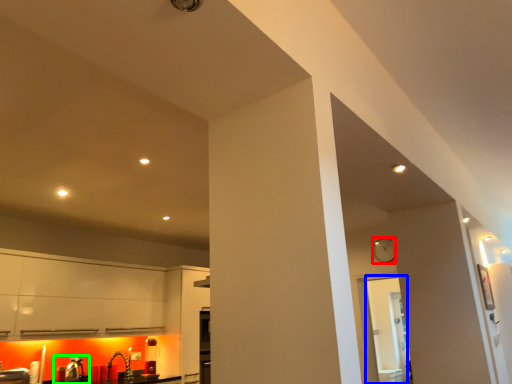
Question: Which object is the closest to the clock (highlighted by a red box)? Choose among these: glass door (highlighted by a blue box) or sink (highlighted by a green box).

Choices:
 (A) glass door
 (B) sink

Answer: (A)